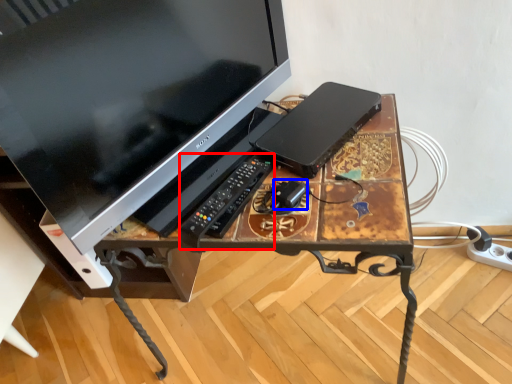
Question: Among these objects, which one is farthest to the camera, control (highlighted by a red box) or gadget (highlighted by a blue box)?

Choices:
 (A) control
 (B) gadget

Answer: (B)